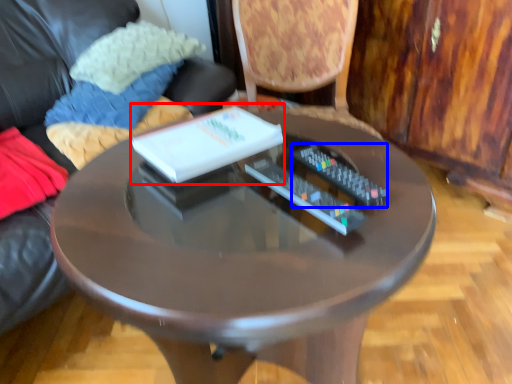
Question: Which point is further to the camera, book (highlighted by a red box) or remote control (highlighted by a blue box)?

Choices:
 (A) book
 (B) remote control

Answer: (A)